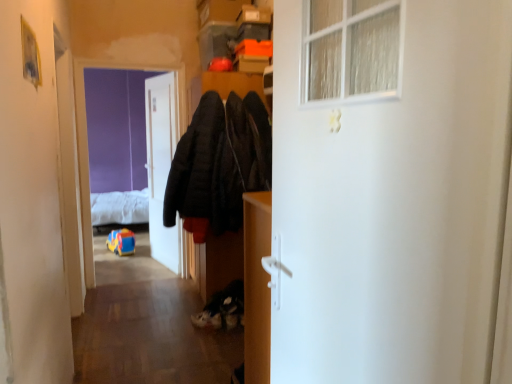
Identify the location of free space on the front side of white glossy door at center, which is the 1th door in left-to-right order. (147, 272).